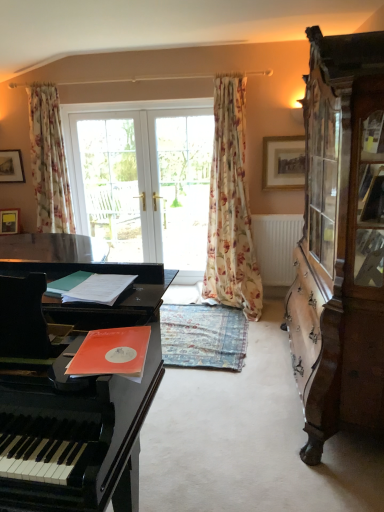
Locate an element on the screen. The width and height of the screenshot is (384, 512). blank space situated above clear glass door at center, which appears as the second screen door when viewed from the right (from a real-world perspective) is located at coordinates (101, 113).